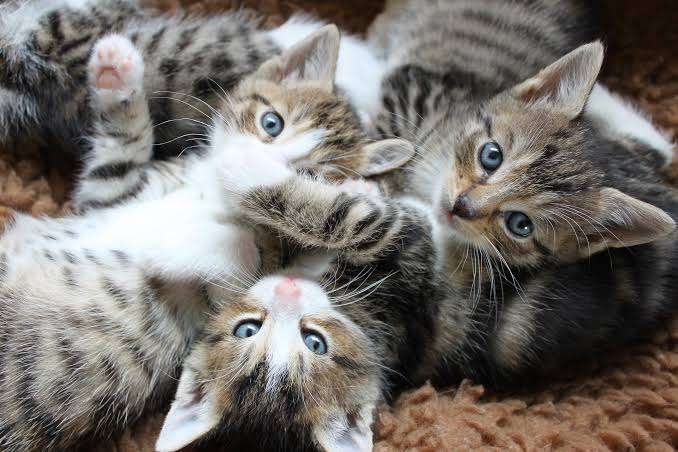
I want to click on carpet, so click(x=502, y=426).